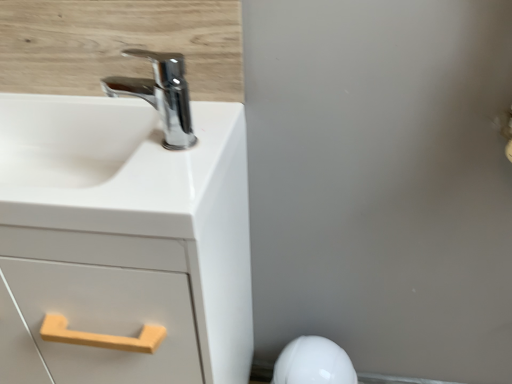
Identify the location of space that is in front of chrome/metallic faucet at upper left. (147, 175).